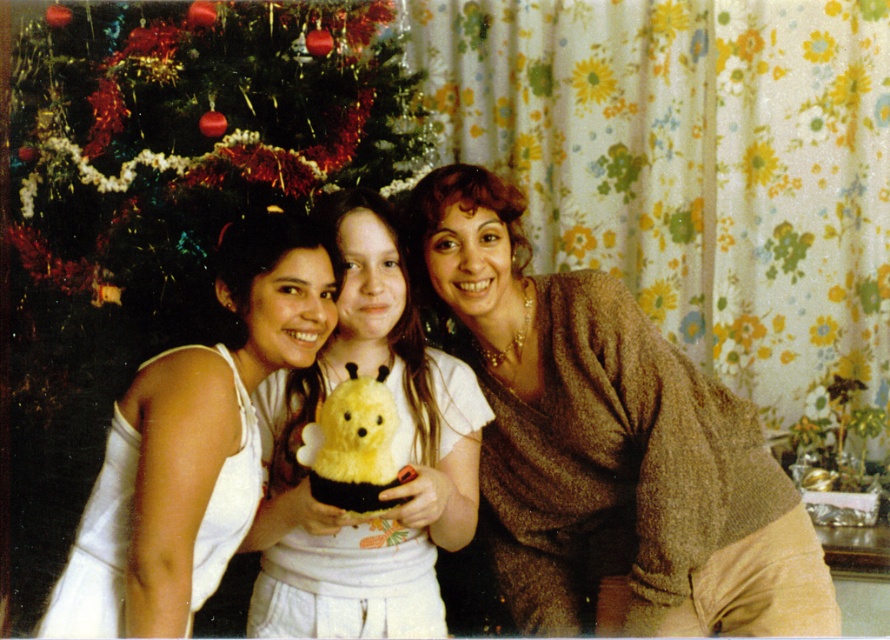
What is the 2D coordinate of the brown textured sweater at center?

The brown textured sweater at center is located at the 2D coordinate point of (605, 444).

You are a photographer standing in front of the green textured christmas tree at upper left and the white fabric at left. You want to take a photo of both objects. Which object should you focus on first if you want to capture both in the same frame without moving the camera?

The green textured christmas tree at upper left is above the white fabric at left, so you should focus on the green textured christmas tree at upper left first to ensure both are in the frame.

You are standing in the room and want to place a gift under the Christmas tree. The gift must be placed exactly at the coordinates where the yellow plush bear at center is located. What are the coordinates where you should place the gift?

The coordinates for placing the gift should be at point (x=393, y=445), which is where the yellow plush bear at center is located.